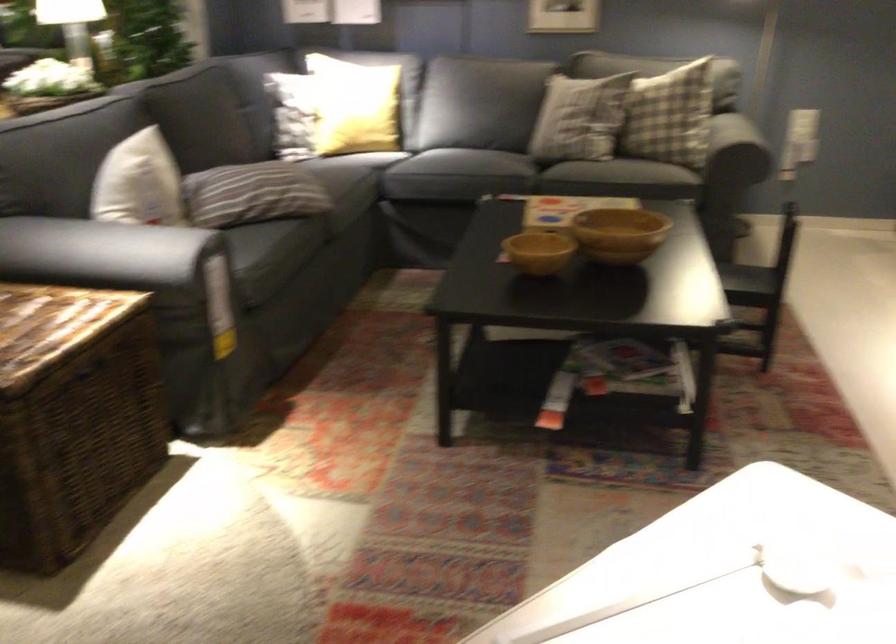
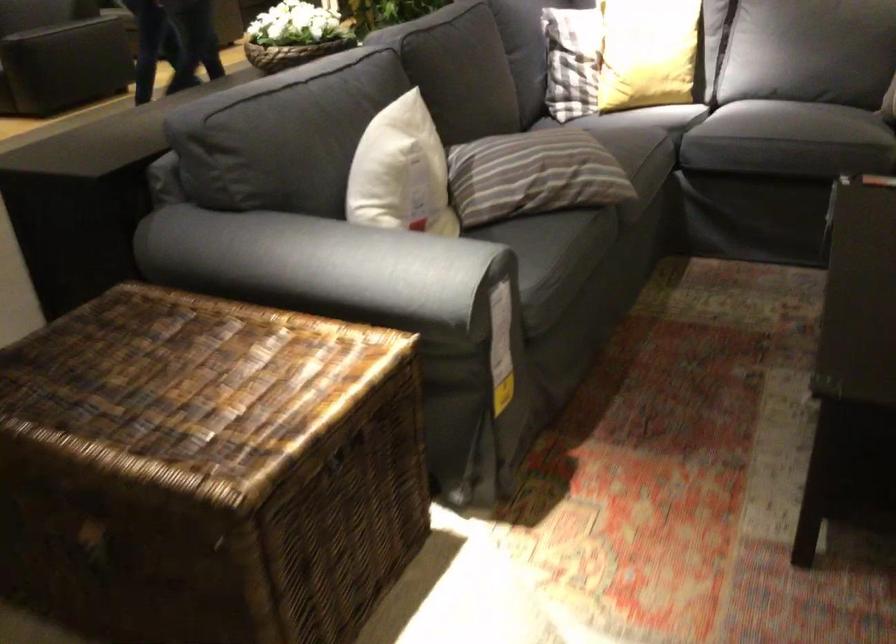
Find the pixel in the second image that matches (440,162) in the first image.

(768, 122)